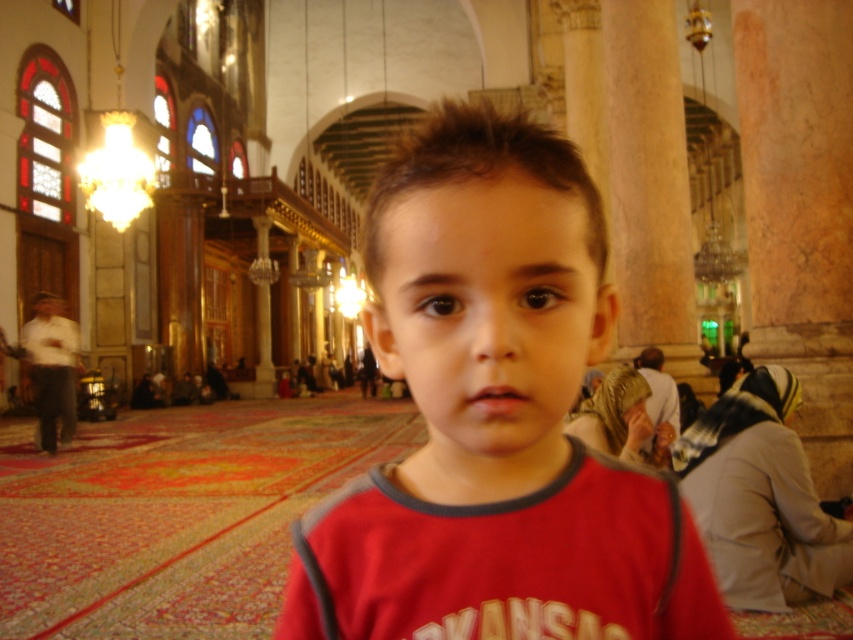
Is point (538, 426) farther from camera compared to point (581, 356)?

No.

Is red matte shirt at center in front of brown matte face at center?

No, red matte shirt at center is behind brown matte face at center.

What are the coordinates of `red matte shirt at center` in the screenshot? It's located at (494, 419).

This screenshot has width=853, height=640. Identify the location of red matte shirt at center. (494, 419).